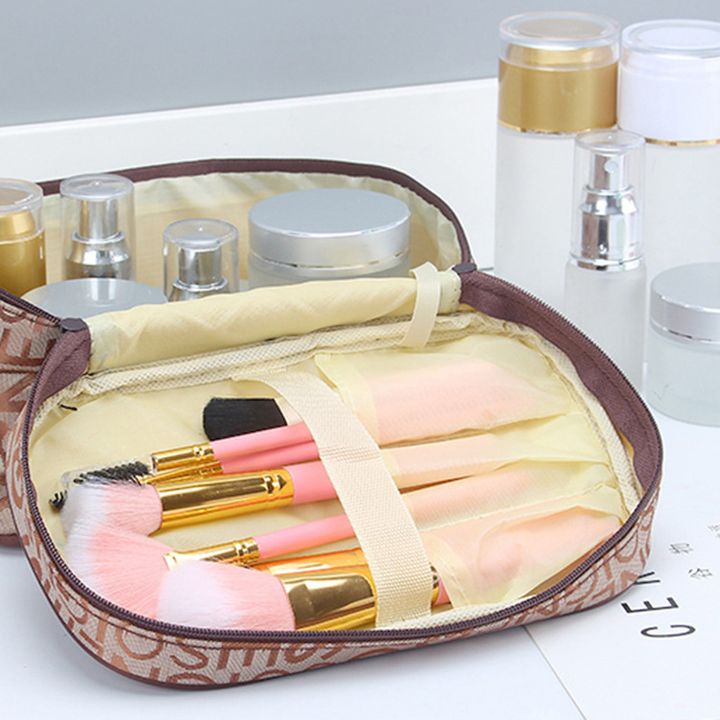
Locate an element on the screen. The width and height of the screenshot is (720, 720). makeup brushes is located at coordinates (246, 420), (122, 464), (54, 503), (93, 502), (122, 552), (247, 600).